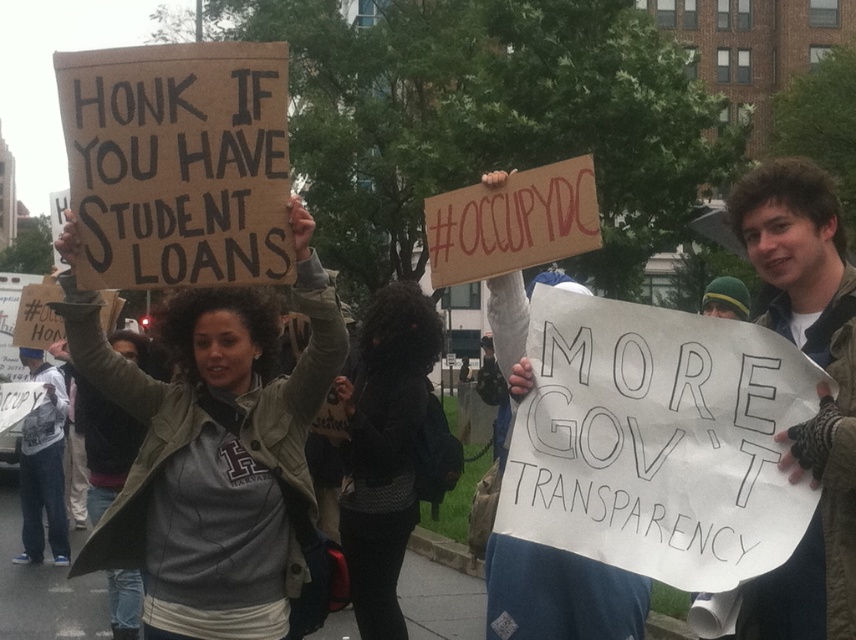
Can you confirm if matte cardboard sign at upper left is positioned above brown leather jacket at upper right?

Correct, matte cardboard sign at upper left is located above brown leather jacket at upper right.

Does matte cardboard sign at upper left have a lesser height compared to brown leather jacket at upper right?

Incorrect, matte cardboard sign at upper left's height does not fall short of brown leather jacket at upper right's.

Describe the element at coordinates (212, 449) in the screenshot. I see `matte cardboard sign at upper left` at that location.

You are a GUI agent. You are given a task and a screenshot of the screen. Output one action in this format:
    pyautogui.click(x=<x>, y=<y>)
    Task: Click on the matte cardboard sign at upper left
    Image resolution: width=856 pixels, height=640 pixels.
    Given the screenshot: What is the action you would take?
    pyautogui.click(x=212, y=449)

Does brown leather jacket at upper right appear under gray fabric jacket at center?

No, brown leather jacket at upper right is not below gray fabric jacket at center.

Between point (852, 378) and point (116, 592), which one is positioned behind?

Point (116, 592)

The width and height of the screenshot is (856, 640). I want to click on brown leather jacket at upper right, so click(819, 394).

Is brown leather jacket at upper right below white paper sign at left?

Incorrect, brown leather jacket at upper right is not positioned below white paper sign at left.

Between point (825, 616) and point (54, 493), which one is positioned behind?

The point (54, 493) is more distant.

What are the coordinates of `brown leather jacket at upper right` in the screenshot? It's located at (819, 394).